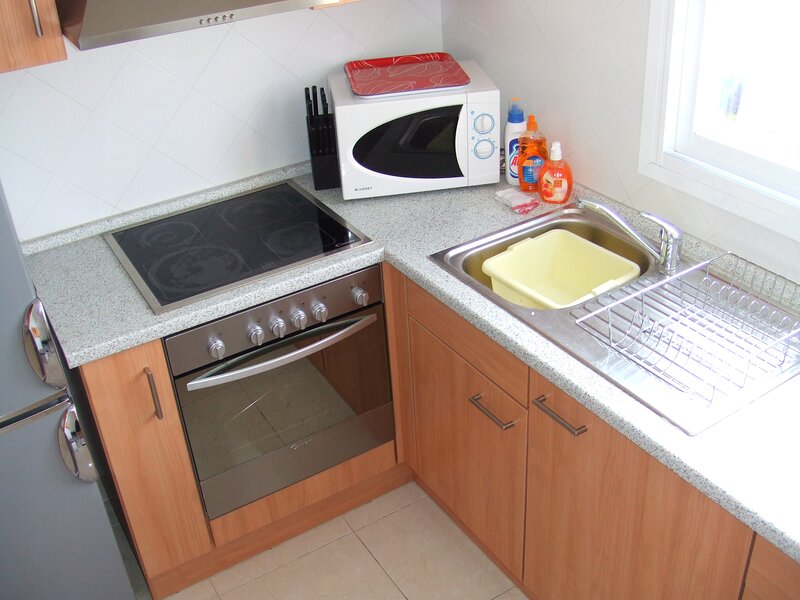
Point to the where to open cabinet under sink right in the image. Your answer should be formatted as a list of tuples, i.e. [(x1, y1), (x2, y2), ...], where each tuple contains the x and y coordinates of a point satisfying the conditions above.

[(554, 418)]